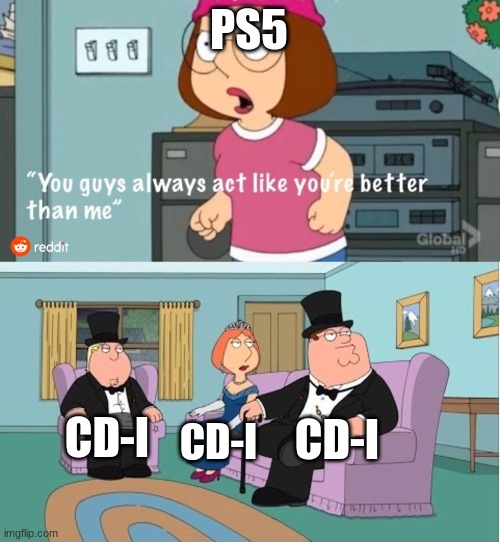
This screenshot has width=500, height=542. In order to click on rug in this screenshot , I will do `click(283, 531)`.